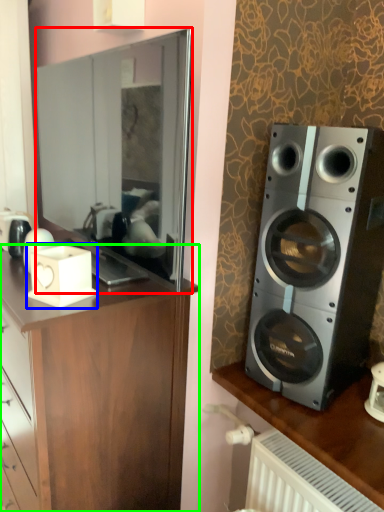
Question: Which is farther away from mirror (highlighted by a red box)? appliance (highlighted by a blue box) or cabinetry (highlighted by a green box)?

Choices:
 (A) appliance
 (B) cabinetry

Answer: (B)